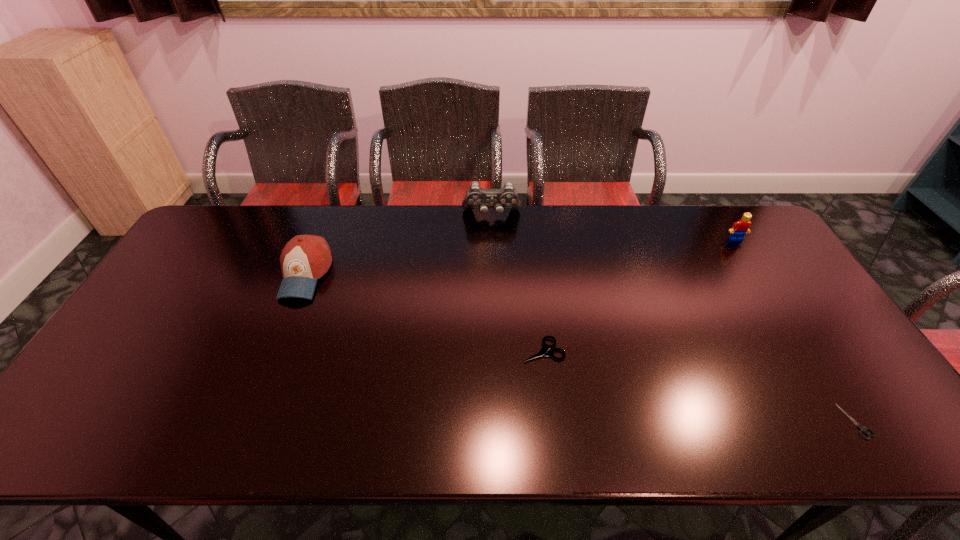
This screenshot has height=540, width=960. What are the coordinates of `object that is at the far right corner` in the screenshot? It's located at (739, 229).

The height and width of the screenshot is (540, 960). Identify the location of object that is positioned at the near right corner. (862, 429).

You are a GUI agent. You are given a task and a screenshot of the screen. Output one action in this format:
    pyautogui.click(x=<x>, y=<y>)
    Task: Click on the free space at the far edge of the desktop
    The width and height of the screenshot is (960, 540).
    Given the screenshot: What is the action you would take?
    pyautogui.click(x=419, y=245)

Find the location of a particular element. This screenshot has height=540, width=960. vacant region at the near edge of the desktop is located at coordinates (138, 417).

What are the coordinates of `vacant region at the right edge of the desktop` in the screenshot? It's located at (820, 319).

The width and height of the screenshot is (960, 540). What are the coordinates of `vacant area at the near left corner` in the screenshot? It's located at click(94, 446).

Where is `free space between the leftmost object and the second nearest object`? The image size is (960, 540). free space between the leftmost object and the second nearest object is located at coordinates (424, 312).

I want to click on empty location between the baseball cap and the second nearest object, so click(424, 312).

Where is `free spot between the second farthest object and the right shears`? This screenshot has height=540, width=960. free spot between the second farthest object and the right shears is located at coordinates (796, 330).

Locate an element on the screen. The width and height of the screenshot is (960, 540). unoccupied area between the tallest object and the nearer shears is located at coordinates (674, 318).